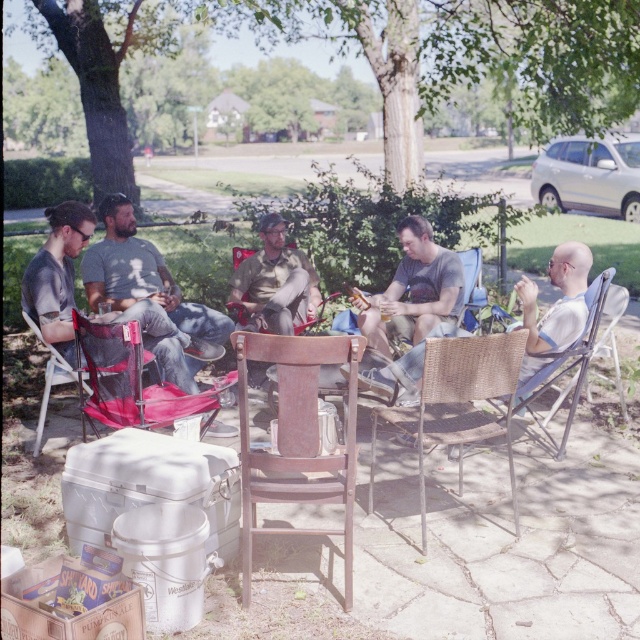
Question: Which point is farther from the camera taking this photo?

Choices:
 (A) (250, 332)
 (B) (593, 353)

Answer: (B)

Question: In this image, where is rustic wood chair at center located relative to matte red folding chair at lower left?

Choices:
 (A) below
 (B) above

Answer: (A)

Question: From the image, what is the correct spatial relationship of green leafy tree at upper center in relation to matte plastic chair at center?

Choices:
 (A) left
 (B) right

Answer: (B)

Question: Can you confirm if rustic wood chair at center is smaller than matte gray shirt at center?

Choices:
 (A) yes
 (B) no

Answer: (A)

Question: Which object is closer to the camera taking this photo?

Choices:
 (A) wicker chair at lower right
 (B) white plastic cooler at lower left
 (C) woven wicker chair at center

Answer: (B)

Question: Which object is closer to the camera taking this photo?

Choices:
 (A) white plastic cooler at lower left
 (B) matte plastic chair at center

Answer: (A)